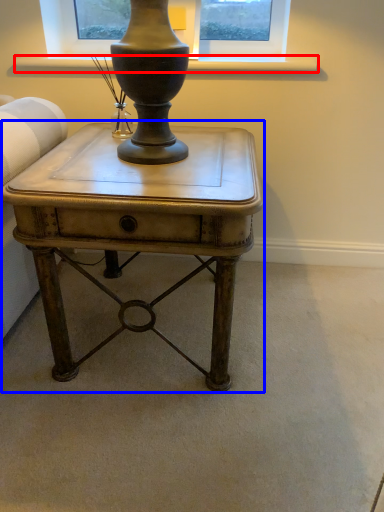
Question: Which object appears farthest to the camera in this image, window sill (highlighted by a red box) or table (highlighted by a blue box)?

Choices:
 (A) window sill
 (B) table

Answer: (A)